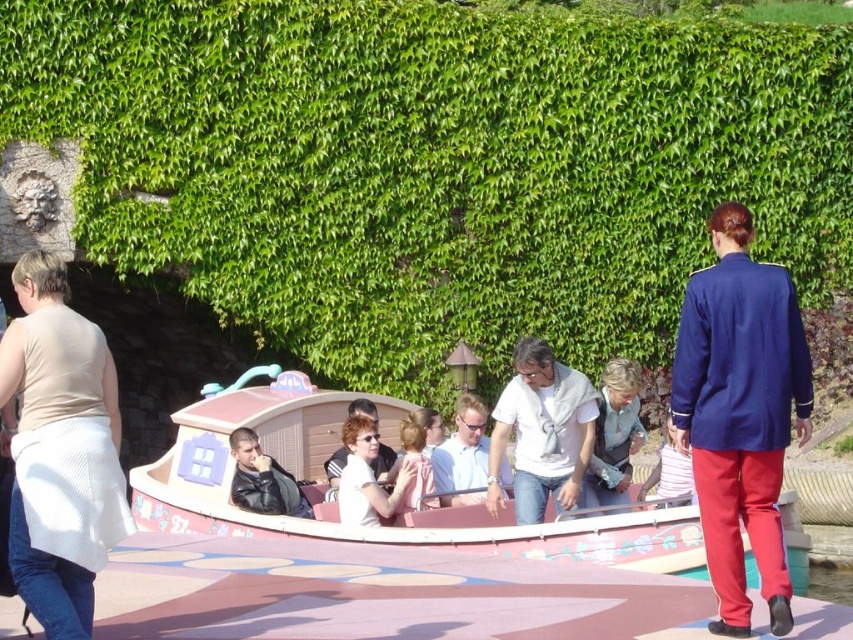
Question: Which object appears closest to the camera in this image?

Choices:
 (A) green leafy hedge at upper center
 (B) leather jacket at center

Answer: (B)

Question: Among these objects, which one is farthest from the camera?

Choices:
 (A) light blue shirt at center
 (B) soft pink fabric at center
 (C) white shirt at center
 (D) matte white blouse at center

Answer: (C)

Question: Is pink matte boat at center closer to camera compared to leather jacket at center?

Choices:
 (A) yes
 (B) no

Answer: (A)

Question: Is beige fabric skirt at lower left closer to the viewer compared to white cotton shirt at center?

Choices:
 (A) no
 (B) yes

Answer: (B)

Question: Among these objects, which one is farthest from the camera?

Choices:
 (A) soft pink fabric at center
 (B) light blue shirt at center
 (C) white shirt at center
 (D) navy blue uniform at right

Answer: (C)

Question: Does light blue shirt at center have a lesser width compared to matte white blouse at center?

Choices:
 (A) no
 (B) yes

Answer: (A)